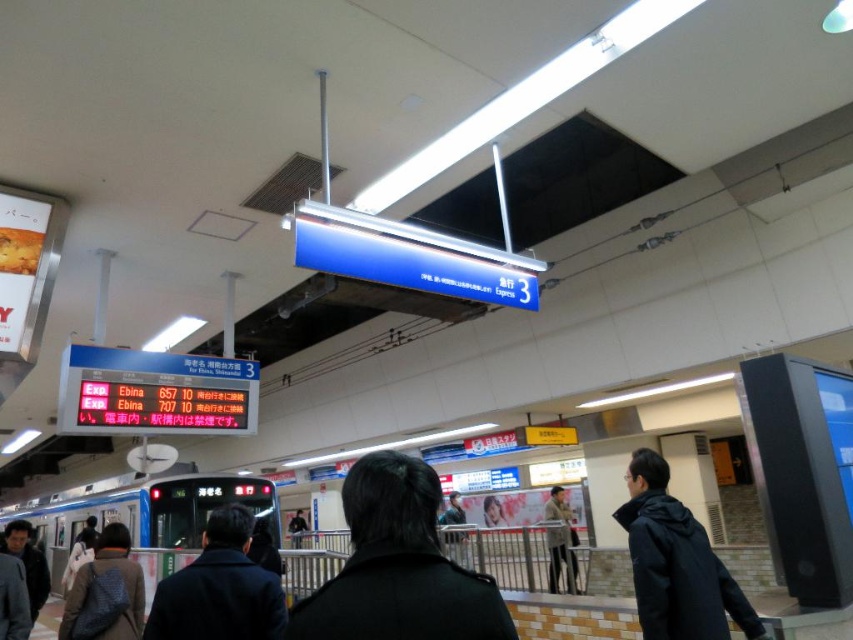
You are a traveler at the train station and want to check the digital display board above the platform. You are currently standing between the dark gray jacket at lower right and the dark brown leather jacket at lower left. Which jacket is closer to you, and will you need to move around it to reach the display board?

The dark brown leather jacket at lower left is closer to you than the dark gray jacket at lower right. Since you are standing between them, you would need to move around the closer jacket, the dark brown leather jacket at lower left, to reach the display board.

You are a commuter with a 1.2 meter wide luggage cart. You need to pass between the black coat at center and the dark blue coat at center. Is there enough space for your cart?

The black coat at center is 1.07 meters from dark blue coat at center. Since your luggage cart is 1.2 meters wide, it is wider than the available space between them. You will not have enough space to pass through with your cart.

You are a photographer standing at the center of the platform. You want to take a photo of both the dark gray jacket at lower right and the dark brown leather jacket at lower left. Which jacket is positioned closer to the right side of your frame?

The dark gray jacket at lower right is positioned closer to the right side of your frame compared to the dark brown leather jacket at lower left.